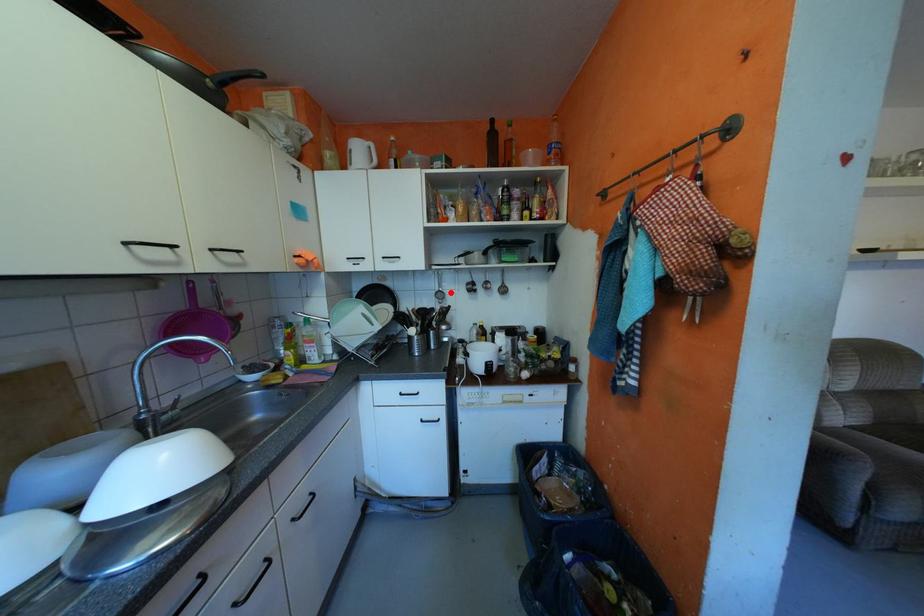
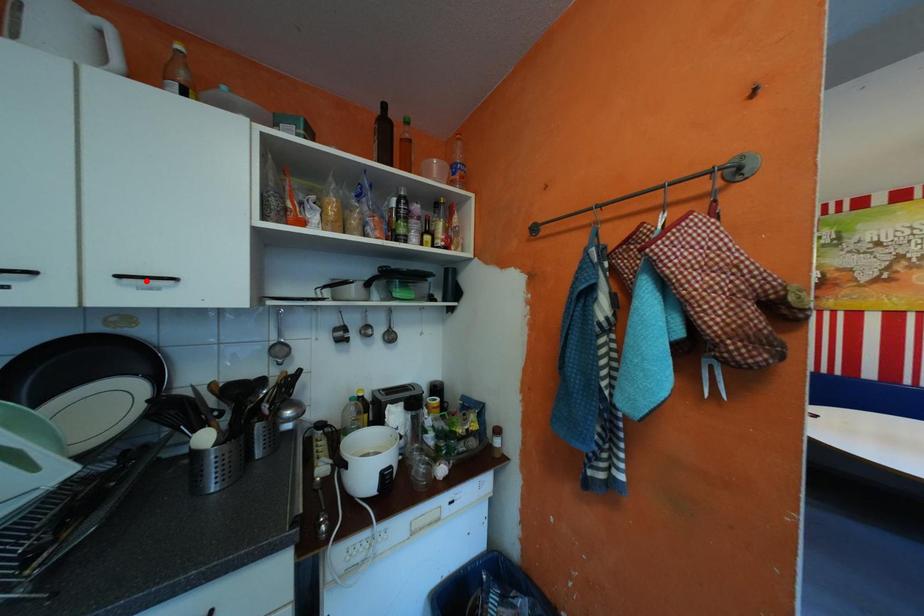
I am providing you with two images of the same scene from different viewpoints. A red point is marked on the first image and another point is marked on the second image. Is the marked point in image1 the same physical position as the marked point in image2?

No